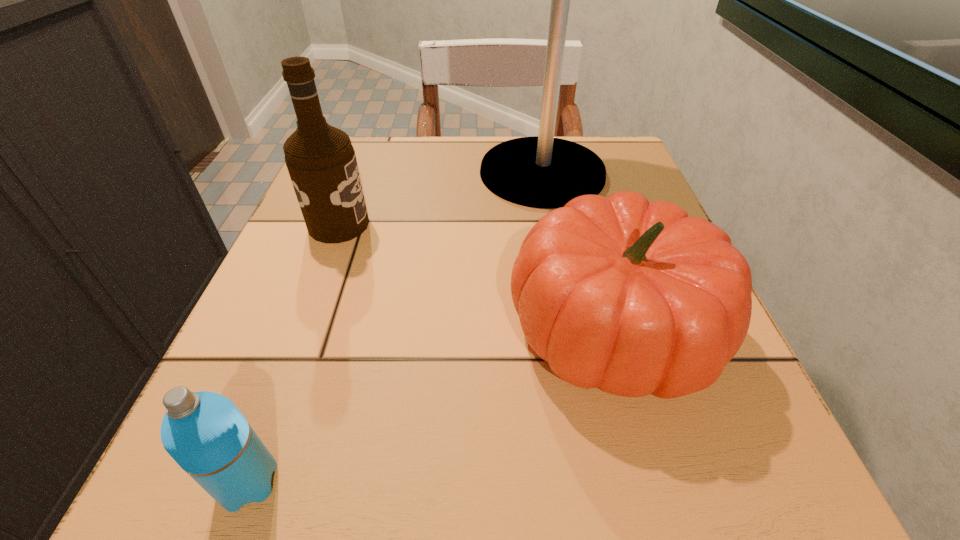
I want to click on vacant space at the near left corner of the desktop, so click(x=277, y=446).

Image resolution: width=960 pixels, height=540 pixels. In order to click on vacant area that lies between the third shortest object and the table lamp in this screenshot , I will do `click(441, 199)`.

Image resolution: width=960 pixels, height=540 pixels. Identify the location of unoccupied area between the third shortest object and the tallest object. (441, 199).

The width and height of the screenshot is (960, 540). What are the coordinates of `free area in between the third shortest object and the second nearest object` in the screenshot? It's located at (474, 277).

At what (x,y) coordinates should I click in order to perform the action: click on empty space between the second tallest object and the table lamp. Please return your answer as a coordinate pair (x, y). The image size is (960, 540). Looking at the image, I should click on (441, 199).

The height and width of the screenshot is (540, 960). In order to click on empty space that is in between the nearest object and the second nearest object in this screenshot , I will do `click(429, 406)`.

At what (x,y) coordinates should I click in order to perform the action: click on vacant area that lies between the thermos bottle and the third farthest object. Please return your answer as a coordinate pair (x, y). Looking at the image, I should click on (429, 406).

The height and width of the screenshot is (540, 960). Find the location of `vacant region between the pumpkin and the thermos bottle`. vacant region between the pumpkin and the thermos bottle is located at coordinates (429, 406).

Where is `free point between the table lamp and the thermos bottle`? free point between the table lamp and the thermos bottle is located at coordinates (396, 327).

Where is `free area in between the nearest object and the third farthest object`? Image resolution: width=960 pixels, height=540 pixels. free area in between the nearest object and the third farthest object is located at coordinates (429, 406).